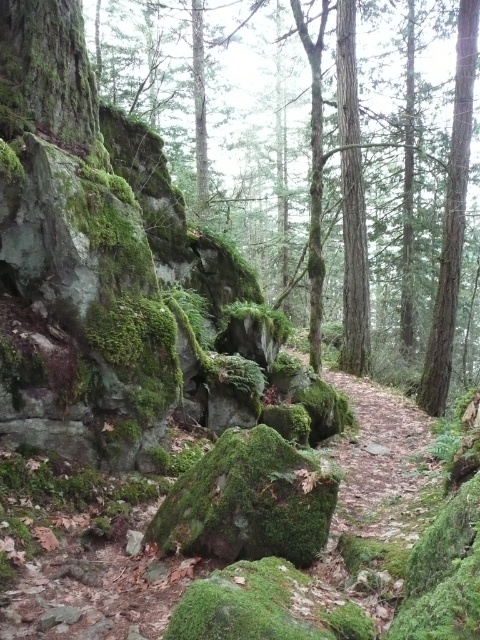
Does point (385, 64) come in front of point (427, 474)?

No, it is not.

Does green mossy rock at center appear over brown dirt path at center?

Correct, green mossy rock at center is located above brown dirt path at center.

Where is `green mossy rock at center`? Image resolution: width=480 pixels, height=640 pixels. green mossy rock at center is located at coordinates (396, 224).